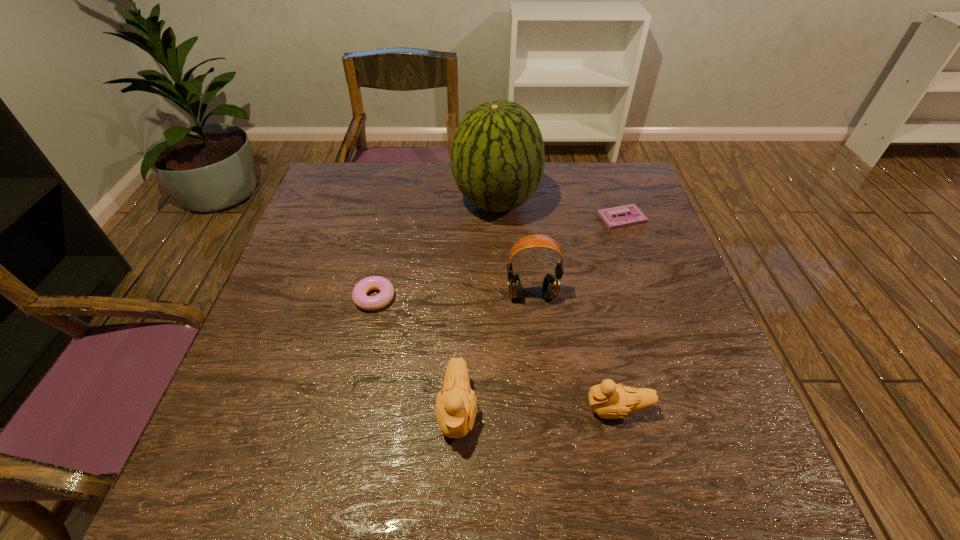
The ducklings are evenly distributed in the image. To maintain this, where would you place another duckling on the left? Please point to a free space. Please provide its 2D coordinates. Your answer should be formatted as a tuple, i.e. [(x, y)], where the tuple contains the x and y coordinates of a point satisfying the conditions above.

[(298, 411)]